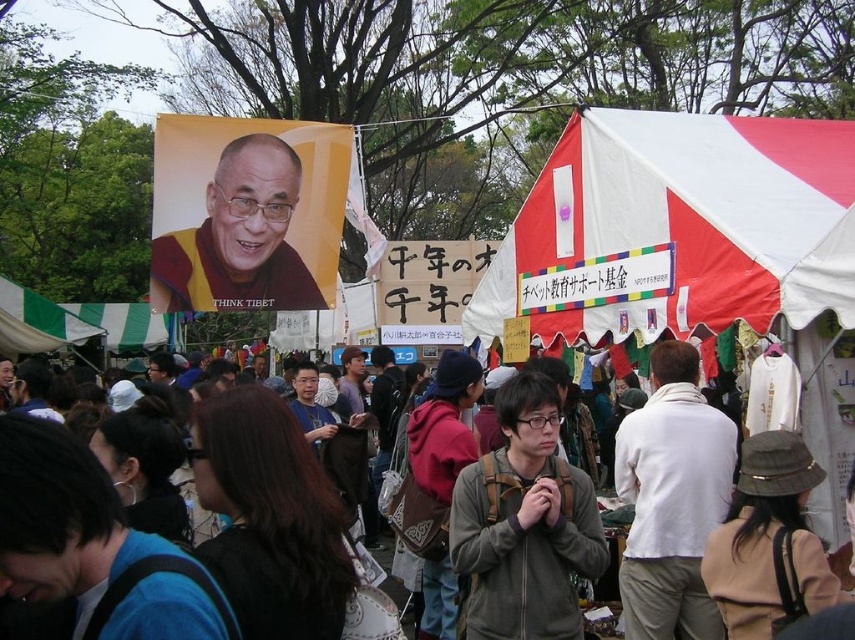
Question: Which point is closer to the camera?

Choices:
 (A) (16, 616)
 (B) (700, 436)

Answer: (A)

Question: Which point is farther to the camera?

Choices:
 (A) red and white tent at upper right
 (B) white matte shirt at center
 (C) brown hair at center

Answer: (B)

Question: Where is red and white tent at upper right located in relation to white matte shirt at center in the image?

Choices:
 (A) below
 (B) above

Answer: (B)

Question: Which of the following is the farthest from the observer?

Choices:
 (A) white matte shirt at center
 (B) red and white tent at upper right

Answer: (A)

Question: Can you confirm if red and white tent at upper right is smaller than brown hair at center?

Choices:
 (A) no
 (B) yes

Answer: (A)

Question: Does red and white tent at upper right appear under white matte shirt at center?

Choices:
 (A) yes
 (B) no

Answer: (B)